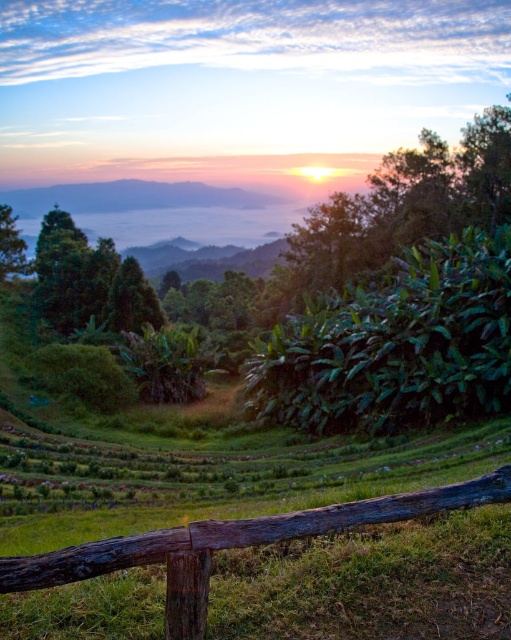
Question: Which of the following is the farthest from the observer?

Choices:
 (A) rustic wooden fence at lower center
 (B) green leafy bush at center-right

Answer: (B)

Question: Does green leafy bush at center-right have a smaller size compared to rustic wooden fence at lower center?

Choices:
 (A) no
 (B) yes

Answer: (A)

Question: Is green leafy bush at center-right below rustic wooden fence at lower center?

Choices:
 (A) yes
 (B) no

Answer: (B)

Question: Is green leafy bush at center-right in front of rustic wooden fence at lower center?

Choices:
 (A) no
 (B) yes

Answer: (A)